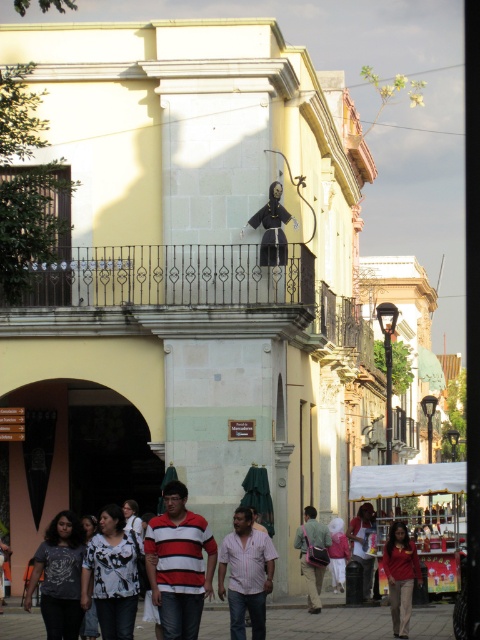
Question: Which of the following is the closest to the observer?

Choices:
 (A) white printed blouse at center
 (B) pink striped shirt at center

Answer: (A)

Question: Where is matte black statue at center located in relation to striped shirt at center in the image?

Choices:
 (A) left
 (B) right

Answer: (B)

Question: Can you confirm if light brown leather jacket at center is smaller than striped shirt at center?

Choices:
 (A) no
 (B) yes

Answer: (B)

Question: Estimate the real-world distances between objects in this image. Which object is closer to the pink striped shirt at center?

Choices:
 (A) matte black statue at center
 (B) striped cotton shirt at center
 (C) dark gray t-shirt at lower left
 (D) matte red shirt at lower right

Answer: (B)

Question: Which point is closer to the camera taking this photo?

Choices:
 (A) (278, 200)
 (B) (321, 582)
 (C) (331, 566)

Answer: (B)

Question: In this image, where is black wrought iron balcony at center located relative to white printed blouse at center?

Choices:
 (A) above
 (B) below

Answer: (A)